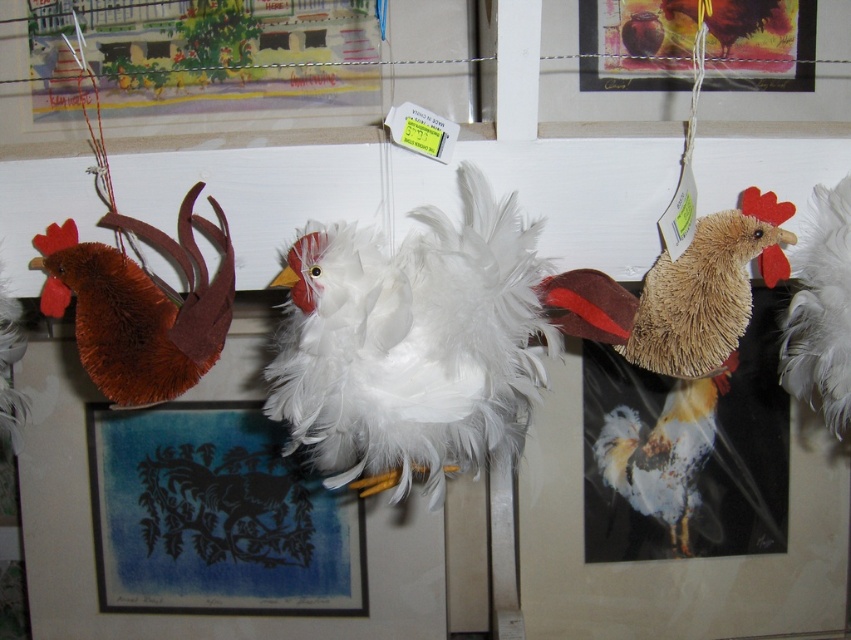
You are standing 25 inches away from a wall with a white feathered chicken at center. Can you reach it with your hand?

The white feathered chicken at center is 24.95 inches away from the viewer, so yes, you can reach it with your hand since it is within arm reach.